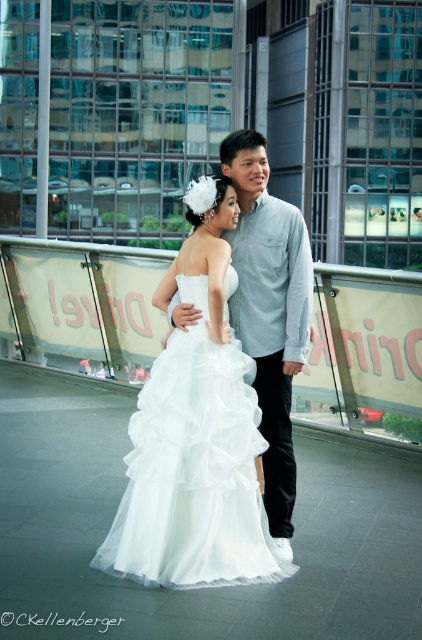
Question: Where is white tulle dress at center located in relation to light blue shirt at center in the image?

Choices:
 (A) right
 (B) left

Answer: (B)

Question: Can you confirm if white tulle dress at center is positioned to the right of light blue shirt at center?

Choices:
 (A) no
 (B) yes

Answer: (A)

Question: Which point is farther to the camera?

Choices:
 (A) (210, 467)
 (B) (246, 166)

Answer: (B)

Question: Which of the following is the closest to the observer?

Choices:
 (A) (154, 509)
 (B) (259, 356)

Answer: (A)

Question: Can you confirm if white tulle dress at center is positioned below light blue shirt at center?

Choices:
 (A) no
 (B) yes

Answer: (B)